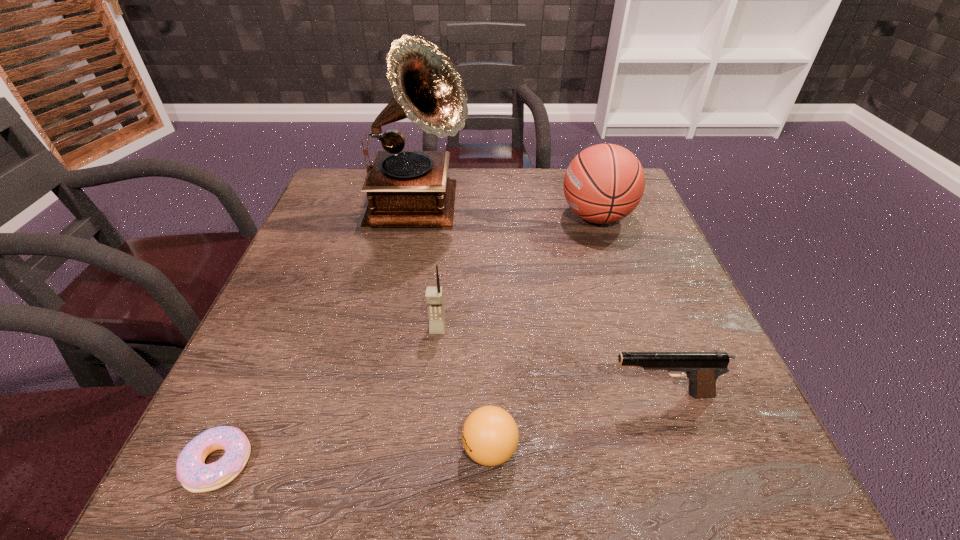
Identify the location of object present at the near left corner. The width and height of the screenshot is (960, 540). (195, 476).

Identify the location of object situated at the far right corner. Image resolution: width=960 pixels, height=540 pixels. (604, 183).

In the image, there is a desktop. Where is `vacant space at the far edge`? This screenshot has height=540, width=960. vacant space at the far edge is located at coordinates (513, 201).

Locate an element on the screen. free point at the near edge is located at coordinates (352, 468).

Image resolution: width=960 pixels, height=540 pixels. In the image, there is a desktop. Find the location of `vacant space at the left edge`. vacant space at the left edge is located at coordinates (359, 232).

Where is `vacant space at the right edge of the desktop`? vacant space at the right edge of the desktop is located at coordinates (619, 258).

This screenshot has width=960, height=540. Find the location of `free space at the far left corner of the desktop`. free space at the far left corner of the desktop is located at coordinates (363, 177).

The image size is (960, 540). In the image, there is a desktop. Find the location of `vacant area at the near left corner`. vacant area at the near left corner is located at coordinates (289, 444).

Locate an element on the screen. This screenshot has width=960, height=540. empty space that is in between the shortest object and the ping-pong ball is located at coordinates (354, 456).

What are the coordinates of `free area in between the basketball and the fourth farthest object` in the screenshot? It's located at (629, 306).